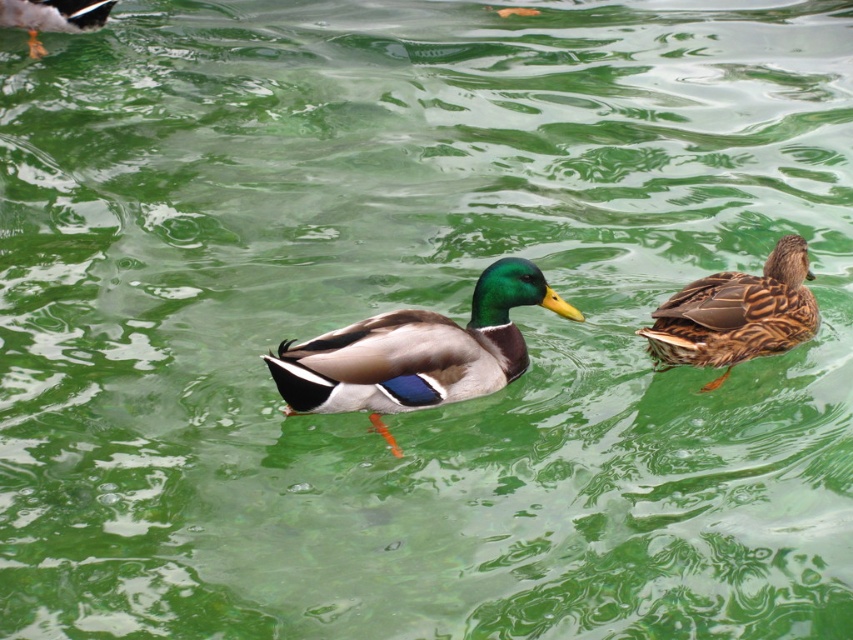
Question: Which point is closer to the camera?

Choices:
 (A) (479, 368)
 (B) (759, 323)
 (C) (71, 24)

Answer: (A)

Question: Does brown textured duck at right appear on the right side of shiny black duck at upper left?

Choices:
 (A) no
 (B) yes

Answer: (B)

Question: Does brown textured duck at right appear on the left side of shiny black duck at upper left?

Choices:
 (A) yes
 (B) no

Answer: (B)

Question: Which of the following is the closest to the observer?

Choices:
 (A) brown textured duck at right
 (B) shiny green duck at center

Answer: (B)

Question: Where is brown textured duck at right located in relation to shiny black duck at upper left in the image?

Choices:
 (A) right
 (B) left

Answer: (A)

Question: Which point is closer to the camera?

Choices:
 (A) (734, 360)
 (B) (457, 362)

Answer: (B)